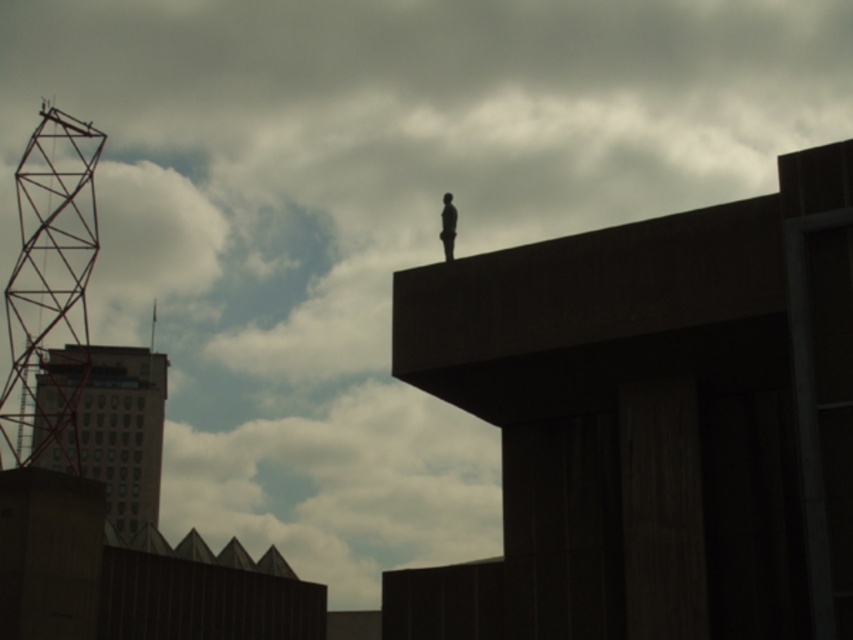
You are an architect reviewing blueprints for a new city project. You notice two elements in the design that could potentially block each other when viewed from the main plaza. The elements are the gray concrete building at left and the silhouette figure at upper center. Based on the image provided, which element would appear closer to the viewer when looking from the plaza?

The gray concrete building at left appears closer to the viewer because the silhouette figure at upper center is positioned behind it.

You are standing in front of the modern building and see two points marked in the image. The first point is at coordinates point (115, 500) and the second is at point (451, 230). Which point is closer to you?

Point (115, 500) is further to the camera than point (451, 230), so the second point is closer to you.